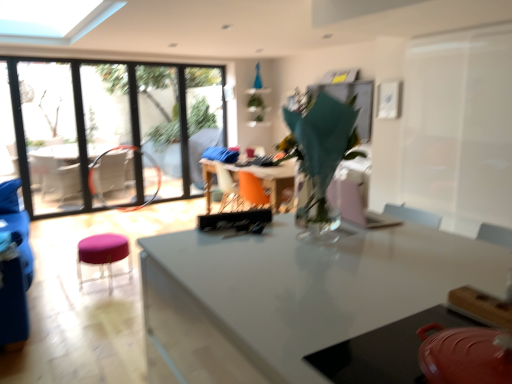
Question: Considering their positions, is translucent glass vase at center located in front of or behind purple fabric stool at lower left?

Choices:
 (A) behind
 (B) front

Answer: (B)

Question: Is point (302, 148) closer or farther from the camera than point (131, 264)?

Choices:
 (A) farther
 (B) closer

Answer: (B)

Question: Estimate the real-world distances between objects in this image. Which object is farther from the matte red pot at lower right, which ranks as the first table in bottom-to-top order?

Choices:
 (A) translucent glass vase at center
 (B) transparent plastic screen door at right
 (C) transparent glass vase at center, which is the first table from back to front
 (D) transparent glass window at left
 (E) purple fabric stool at lower left

Answer: (D)

Question: Based on their relative distances, which object is nearer to the transparent glass vase at center, which is the first table from back to front?

Choices:
 (A) translucent glass vase at center
 (B) purple fabric stool at lower left
 (C) green leafy plant at upper center
 (D) matte red pot at lower right, acting as the 2th table starting from the back
 (E) transparent glass window at left

Answer: (B)